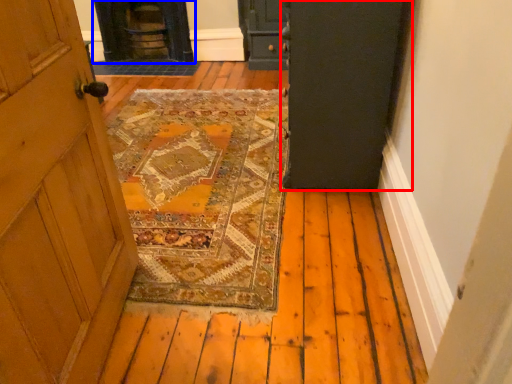
Question: Which of the following is the farthest to the observer, door (highlighted by a red box) or stove (highlighted by a blue box)?

Choices:
 (A) door
 (B) stove

Answer: (B)